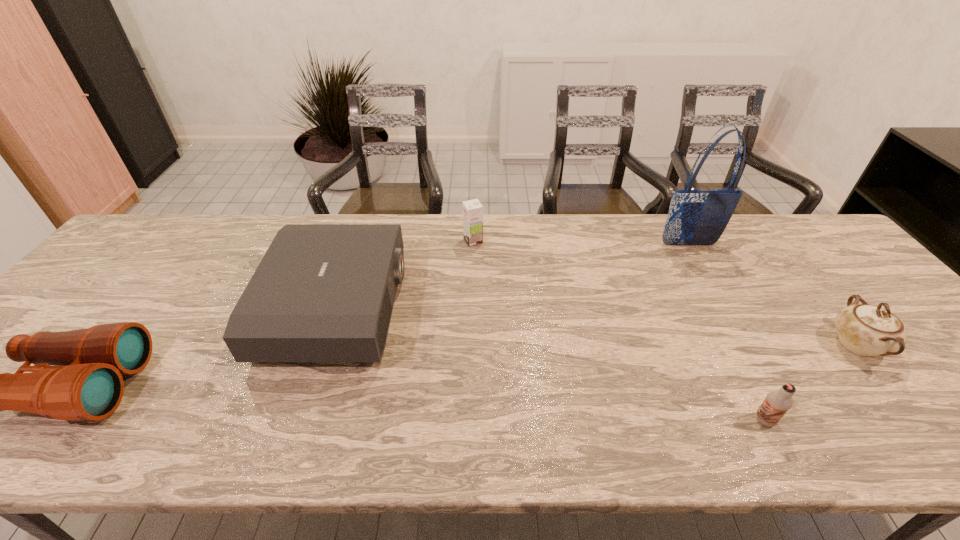
I want to click on vacant space at the right edge, so click(x=875, y=293).

Locate an element on the screen. The width and height of the screenshot is (960, 540). vacant space that is in between the chinaware and the tallest object is located at coordinates (772, 294).

Where is `empty space that is in between the shopping bag and the farther chocolate milk`? empty space that is in between the shopping bag and the farther chocolate milk is located at coordinates (581, 242).

Find the location of a particular element. This screenshot has width=960, height=540. free space between the rightmost object and the projector is located at coordinates (596, 326).

I want to click on vacant area that lies between the shopping bag and the right chocolate milk, so 727,332.

Locate an element on the screen. This screenshot has height=540, width=960. free space between the shopping bag and the projector is located at coordinates (513, 275).

At what (x,y) coordinates should I click in order to perform the action: click on free space between the right chocolate milk and the left chocolate milk. Please return your answer as a coordinate pair (x, y). Looking at the image, I should click on (619, 330).

The image size is (960, 540). Identify the location of unoccupied position between the farther chocolate milk and the tallest object. (581, 242).

Locate an element on the screen. The height and width of the screenshot is (540, 960). object that is the fifth closest to the projector is located at coordinates (867, 330).

Choose which object is the third nearest neighbor to the nearer chocolate milk. Please provide its 2D coordinates. Your answer should be formatted as a tuple, i.e. [(x, y)], where the tuple contains the x and y coordinates of a point satisfying the conditions above.

[(322, 292)]